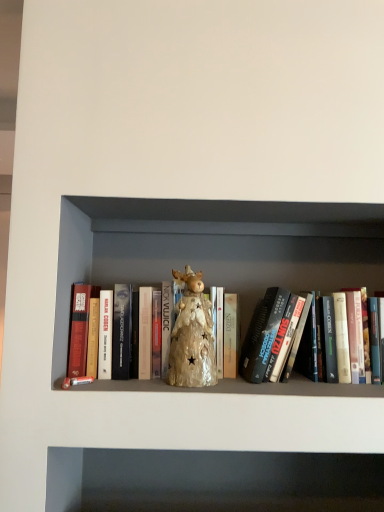
Locate an element on the screen. The height and width of the screenshot is (512, 384). iridescent ceramic reindeer at center is located at coordinates (192, 336).

Describe the element at coordinates (192, 336) in the screenshot. I see `iridescent ceramic reindeer at center` at that location.

I want to click on matte gold statue at center, so click(x=97, y=339).

The image size is (384, 512). What do you see at coordinates (97, 339) in the screenshot? I see `matte gold statue at center` at bounding box center [97, 339].

At what (x,y) coordinates should I click in order to perform the action: click on iridescent ceramic reindeer at center. Please return your answer as a coordinate pair (x, y). Looking at the image, I should click on (192, 336).

In the scene shown: Which is more to the right, matte gold statue at center or iridescent ceramic reindeer at center?

matte gold statue at center is more to the right.

Which is behind, matte gold statue at center or iridescent ceramic reindeer at center?

matte gold statue at center is behind.

Is point (355, 378) closer or farther from the camera than point (181, 370)?

Point (355, 378) is farther from the camera than point (181, 370).

From the image's perspective, is matte gold statue at center above or below iridescent ceramic reindeer at center?

Based on their image positions, matte gold statue at center is located beneath iridescent ceramic reindeer at center.

From a real-world perspective, is matte gold statue at center physically above iridescent ceramic reindeer at center?

Indeed, from a real-world perspective, matte gold statue at center stands above iridescent ceramic reindeer at center.

Is matte gold statue at center wider or thinner than iridescent ceramic reindeer at center?

Clearly, matte gold statue at center has more width compared to iridescent ceramic reindeer at center.

Does matte gold statue at center have a greater height compared to iridescent ceramic reindeer at center?

Yes, matte gold statue at center is taller than iridescent ceramic reindeer at center.

Does matte gold statue at center have a smaller size compared to iridescent ceramic reindeer at center?

Incorrect, matte gold statue at center is not smaller in size than iridescent ceramic reindeer at center.

Is matte gold statue at center inside the boundaries of iridescent ceramic reindeer at center, or outside?

matte gold statue at center cannot be found inside iridescent ceramic reindeer at center.

Is matte gold statue at center far from iridescent ceramic reindeer at center?

No, matte gold statue at center is not far from iridescent ceramic reindeer at center.

Is matte gold statue at center positioned with its back to iridescent ceramic reindeer at center?

Yes, iridescent ceramic reindeer at center is at the back of matte gold statue at center.

How much distance is there between matte gold statue at center and iridescent ceramic reindeer at center?

matte gold statue at center is 4.20 inches from iridescent ceramic reindeer at center.

At what (x,y) coordinates should I click in order to perform the action: click on book on the right of iridescent ceramic reindeer at center. Please return your answer as a coordinate pair (x, y). Looking at the image, I should click on (97, 339).

In the image, is iridescent ceramic reindeer at center on the left side or the right side of matte gold statue at center?

iridescent ceramic reindeer at center is to the left of matte gold statue at center.

Which is in front, iridescent ceramic reindeer at center or matte gold statue at center?

iridescent ceramic reindeer at center is closer to the camera.

Considering the points (198, 341) and (288, 354), which point is behind, point (198, 341) or point (288, 354)?

The point (288, 354) is farther from the camera.

From the image's perspective, which is above, iridescent ceramic reindeer at center or matte gold statue at center?

iridescent ceramic reindeer at center, from the image's perspective.

From a real-world perspective, is iridescent ceramic reindeer at center physically below matte gold statue at center?

Yes.

From the picture: Considering the sizes of iridescent ceramic reindeer at center and matte gold statue at center in the image, is iridescent ceramic reindeer at center wider or thinner than matte gold statue at center?

In the image, iridescent ceramic reindeer at center appears to be more narrow than matte gold statue at center.

Considering the sizes of iridescent ceramic reindeer at center and matte gold statue at center in the image, is iridescent ceramic reindeer at center taller or shorter than matte gold statue at center?

In the image, iridescent ceramic reindeer at center appears to be shorter than matte gold statue at center.

Can you confirm if iridescent ceramic reindeer at center is bigger than matte gold statue at center?

No.

Is iridescent ceramic reindeer at center situated inside matte gold statue at center or outside?

iridescent ceramic reindeer at center is enclosed within matte gold statue at center.

Are iridescent ceramic reindeer at center and matte gold statue at center located far from each other?

No, iridescent ceramic reindeer at center is not far from matte gold statue at center.

Is iridescent ceramic reindeer at center oriented away from matte gold statue at center?

Answer: Correct, iridescent ceramic reindeer at center is looking away from matte gold statue at center.

What's the angular difference between iridescent ceramic reindeer at center and matte gold statue at center's facing directions?

0.000793 degrees separate the facing orientations of iridescent ceramic reindeer at center and matte gold statue at center.

The image size is (384, 512). Identify the location of toy that is above the matte gold statue at center (from the image's perspective). (192, 336).

Identify the location of toy that is in front of the matte gold statue at center. (192, 336).

Where is `toy directly beneath the matte gold statue at center (from a real-world perspective)`? The width and height of the screenshot is (384, 512). toy directly beneath the matte gold statue at center (from a real-world perspective) is located at coordinates (192, 336).